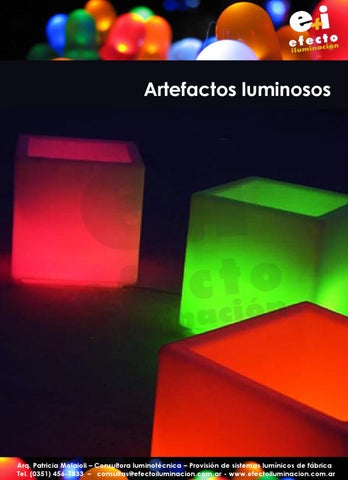
You are a GUI agent. You are given a task and a screenshot of the screen. Output one action in this format:
    pyautogui.click(x=<x>, y=<y>)
    Task: Click on the artefactos luminosos
    
    Given the screenshot: What is the action you would take?
    pyautogui.click(x=198, y=90)